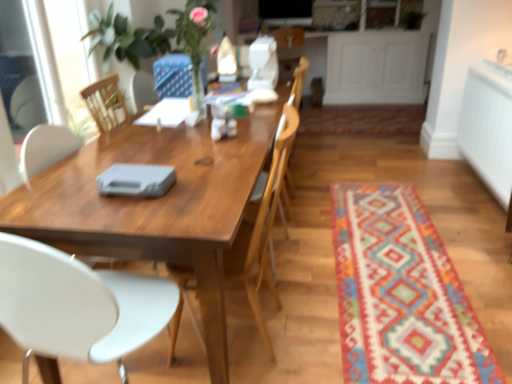
Question: Is blue fabric armchair at upper center, the 1th armchair viewed from the left, aimed at multicolored woven rug at center, which appears as the second mat when viewed from the front?

Choices:
 (A) no
 (B) yes

Answer: (A)

Question: From the image's perspective, is blue fabric armchair at upper center, which is counted as the second armchair, starting from the right, under multicolored woven rug at center, the first mat when ordered from top to bottom?

Choices:
 (A) no
 (B) yes

Answer: (B)

Question: Considering the relative sizes of blue fabric armchair at upper center, which is counted as the second armchair, starting from the right, and multicolored woven rug at center, which is the first mat in back-to-front order, in the image provided, is blue fabric armchair at upper center, which is counted as the second armchair, starting from the right, thinner than multicolored woven rug at center, which is the first mat in back-to-front order,?

Choices:
 (A) yes
 (B) no

Answer: (A)

Question: Considering the relative sizes of blue fabric armchair at upper center, the 1th armchair viewed from the left, and multicolored woven rug at center, which appears as the second mat when viewed from the front, in the image provided, is blue fabric armchair at upper center, the 1th armchair viewed from the left, shorter than multicolored woven rug at center, which appears as the second mat when viewed from the front,?

Choices:
 (A) yes
 (B) no

Answer: (B)

Question: From a real-world perspective, does blue fabric armchair at upper center, which is counted as the second armchair, starting from the right, sit lower than multicolored woven rug at center, which is the first mat in back-to-front order?

Choices:
 (A) yes
 (B) no

Answer: (B)

Question: Is wooden chair at center, which is the first chair in right-to-left order, taller or shorter than white plastic chair at left, marked as the first chair in a left-to-right arrangement?

Choices:
 (A) tall
 (B) short

Answer: (A)

Question: From the image's perspective, is wooden chair at center, which is the first chair in right-to-left order, above or below white plastic chair at left, marked as the second chair in a right-to-left arrangement?

Choices:
 (A) below
 (B) above

Answer: (B)

Question: Based on their sizes in the image, would you say wooden chair at center, which is the first chair in right-to-left order, is bigger or smaller than white plastic chair at left, marked as the second chair in a right-to-left arrangement?

Choices:
 (A) big
 (B) small

Answer: (B)

Question: Looking at their shapes, would you say wooden chair at center, which is the first chair in right-to-left order, is wider or thinner than white plastic chair at left, marked as the first chair in a left-to-right arrangement?

Choices:
 (A) thin
 (B) wide

Answer: (B)

Question: Based on their sizes in the image, would you say multicolored woven rug at center, which appears as the second mat when ordered from the bottom, is bigger or smaller than blue fabric armchair at upper center, which is counted as the second armchair, starting from the right?

Choices:
 (A) small
 (B) big

Answer: (B)

Question: Choose the correct answer: Is multicolored woven rug at center, which appears as the second mat when ordered from the bottom, inside blue fabric armchair at upper center, which is counted as the second armchair, starting from the right, or outside it?

Choices:
 (A) outside
 (B) inside

Answer: (A)

Question: Looking at their shapes, would you say multicolored woven rug at center, which is the first mat in back-to-front order, is wider or thinner than blue fabric armchair at upper center, the 1th armchair viewed from the left?

Choices:
 (A) wide
 (B) thin

Answer: (A)

Question: From their relative heights in the image, would you say multicolored woven rug at center, which appears as the second mat when viewed from the front, is taller or shorter than blue fabric armchair at upper center, the 1th armchair viewed from the left?

Choices:
 (A) short
 (B) tall

Answer: (A)

Question: Is point (395, 228) positioned closer to the camera than point (483, 117)?

Choices:
 (A) closer
 (B) farther

Answer: (A)

Question: Would you say multicolored woven mat at lower right, the first mat positioned from the bottom, is inside or outside white textured radiator at right?

Choices:
 (A) inside
 (B) outside

Answer: (B)